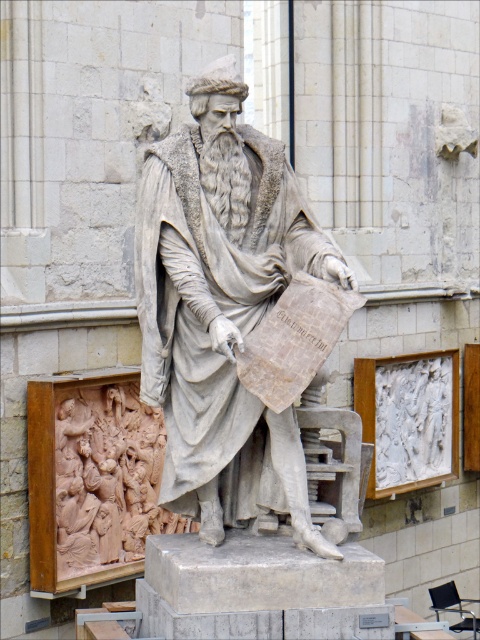
You are an art conservator tasked with moving a large crate that is 14 meters long. You need to transport it from the gray stone statue at center to the light brown wood carving at lower left. Is there enough space to move the crate without tilting it sideways?

The distance between the gray stone statue at center and the light brown wood carving at lower left is 15.50 meters. Since the crate is 14 meters long, there is enough space to move it without tilting sideways.

You are an art conservator examining the image. You need to assess the placement of the gray stone statue at center and the light brown wood carving at lower left. From the perspective of someone standing directly in front of the image, which object is positioned to the left?

The light brown wood carving at lower left is positioned to the left of the gray stone statue at center.